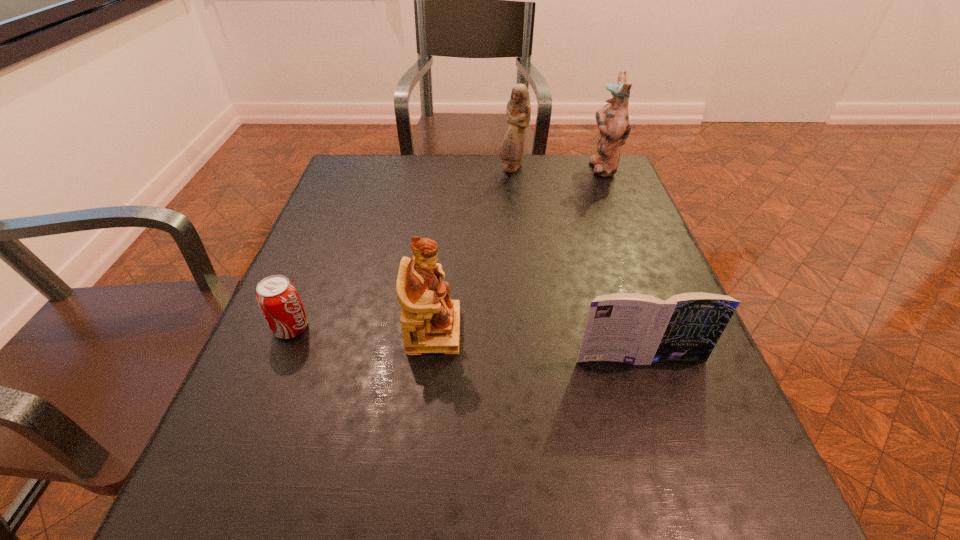
Where is `vacant region located 0.180m on the front-facing side of the third object from right to left`? vacant region located 0.180m on the front-facing side of the third object from right to left is located at coordinates (517, 214).

Identify the location of vacant region located on the front-facing side of the fourth object from right to left. This screenshot has height=540, width=960. (568, 330).

Locate an element on the screen. The image size is (960, 540). free region located 0.150m on the front cover of the book is located at coordinates tap(669, 449).

The image size is (960, 540). Identify the location of free region located on the right of the leftmost object. (405, 328).

In order to click on object at the left edge in this screenshot , I will do `click(278, 299)`.

Where is `figurine that is at the right edge`? Image resolution: width=960 pixels, height=540 pixels. figurine that is at the right edge is located at coordinates (612, 119).

Find the location of a particular element. The image size is (960, 540). book that is at the right edge is located at coordinates (639, 329).

This screenshot has width=960, height=540. Identify the location of object present at the far right corner. (612, 119).

Identify the location of vacant space at the far edge. (415, 192).

Locate an element on the screen. The width and height of the screenshot is (960, 540). vacant area at the near edge is located at coordinates (394, 497).